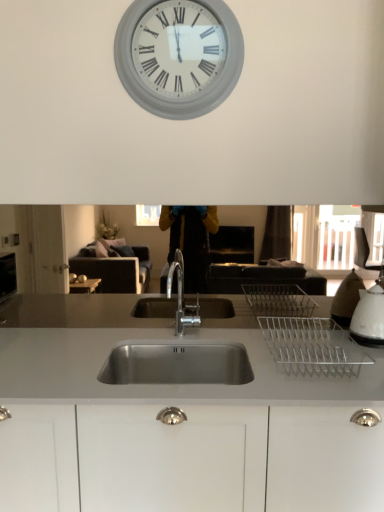
Where is `white matte clock at upper center`? The width and height of the screenshot is (384, 512). white matte clock at upper center is located at coordinates click(179, 55).

What do you see at coordinates (175, 425) in the screenshot?
I see `stainless steel sink at center` at bounding box center [175, 425].

This screenshot has width=384, height=512. In order to click on white glossy kettle at right in this screenshot , I will do `click(369, 317)`.

In the scene shown: Is white matte clock at upper center closer to the viewer compared to white glossy kettle at right?

That is False.

Find the location of `appliance on the right side of white matte clock at upper center`. appliance on the right side of white matte clock at upper center is located at coordinates (369, 317).

From the image's perspective, would you say white matte clock at upper center is shown under white glossy kettle at right?

No, from the image's perspective, white matte clock at upper center is not beneath white glossy kettle at right.

What's the angular difference between white matte clock at upper center and white glossy kettle at right's facing directions?

They differ by 1.24 degrees in their facing directions.

Does stainless steel sink at center have a greater height compared to white matte clock at upper center?

Yes, stainless steel sink at center is taller than white matte clock at upper center.

Considering the positions of objects stainless steel sink at center and white matte clock at upper center in the image provided, who is more to the right, stainless steel sink at center or white matte clock at upper center?

stainless steel sink at center.

The width and height of the screenshot is (384, 512). Identify the location of wall clock above the stainless steel sink at center (from the image's perspective). (179, 55).

Considering the positions of point (27, 320) and point (135, 32), is point (27, 320) closer or farther from the camera than point (135, 32)?

Point (27, 320).

Does white matte clock at upper center touch stainless steel sink at center?

No.

From the image's perspective, is white matte clock at upper center beneath stainless steel sink at center?

Incorrect, from the image's perspective, white matte clock at upper center is higher than stainless steel sink at center.

Consider the image. From a real-world perspective, which object rests below the other?

From a 3D spatial view, stainless steel sink at center is below.

Is white matte clock at upper center wider or thinner than stainless steel sink at center?

Clearly, white matte clock at upper center has less width compared to stainless steel sink at center.

Considering the relative sizes of white glossy kettle at right and stainless steel sink at center in the image provided, is white glossy kettle at right thinner than stainless steel sink at center?

Indeed, white glossy kettle at right has a lesser width compared to stainless steel sink at center.

Is white glossy kettle at right located outside stainless steel sink at center?

Yes, white glossy kettle at right is located beyond the bounds of stainless steel sink at center.

Looking at this image, is white glossy kettle at right beside stainless steel sink at center?

white glossy kettle at right and stainless steel sink at center are clearly separated.

Considering the relative positions of white glossy kettle at right and stainless steel sink at center in the image provided, is white glossy kettle at right to the right of stainless steel sink at center from the viewer's perspective?

Yes.

Which object is positioned more to the left, stainless steel sink at center or white glossy kettle at right?

stainless steel sink at center.

What are the coordinates of `appliance above the stainless steel sink at center (from a real-world perspective)` in the screenshot? It's located at (369, 317).

Is stainless steel sink at center next to white glossy kettle at right and touching it?

No, stainless steel sink at center is not beside white glossy kettle at right.

Identify the location of wall clock behind the white glossy kettle at right. The image size is (384, 512). (179, 55).

Is white matte clock at upper center a part of white glossy kettle at right?

No, white matte clock at upper center is not surrounded by white glossy kettle at right.

Considering the sizes of white glossy kettle at right and white matte clock at upper center in the image, is white glossy kettle at right taller or shorter than white matte clock at upper center?

Clearly, white glossy kettle at right is shorter compared to white matte clock at upper center.

Where is `wall clock on the left of white glossy kettle at right`? The image size is (384, 512). wall clock on the left of white glossy kettle at right is located at coordinates (179, 55).

Locate an element on the screen. The height and width of the screenshot is (512, 384). countertop that appears below the white matte clock at upper center (from the image's perspective) is located at coordinates (175, 425).

Considering their positions, is stainless steel sink at center positioned closer to white glossy kettle at right than white matte clock at upper center?

stainless steel sink at center is closer to white glossy kettle at right.

When comparing their distances from white glossy kettle at right, does white matte clock at upper center or stainless steel sink at center seem further?

Based on the image, white matte clock at upper center appears to be further to white glossy kettle at right.

When comparing their distances from white matte clock at upper center, does stainless steel sink at center or white glossy kettle at right seem further?

white glossy kettle at right is positioned further to the anchor white matte clock at upper center.

Looking at the image, which one is located further to stainless steel sink at center, white matte clock at upper center or white glossy kettle at right?

Among the two, white matte clock at upper center is located further to stainless steel sink at center.

Based on the photo, looking at the image, which one is located further to white matte clock at upper center, white glossy kettle at right or stainless steel sink at center?

white glossy kettle at right is further to white matte clock at upper center.

Based on the photo, when comparing their distances from stainless steel sink at center, does white glossy kettle at right or white matte clock at upper center seem further?

Based on the image, white matte clock at upper center appears to be further to stainless steel sink at center.

Where is `appliance between white matte clock at upper center and stainless steel sink at center vertically`? This screenshot has height=512, width=384. appliance between white matte clock at upper center and stainless steel sink at center vertically is located at coordinates (369, 317).